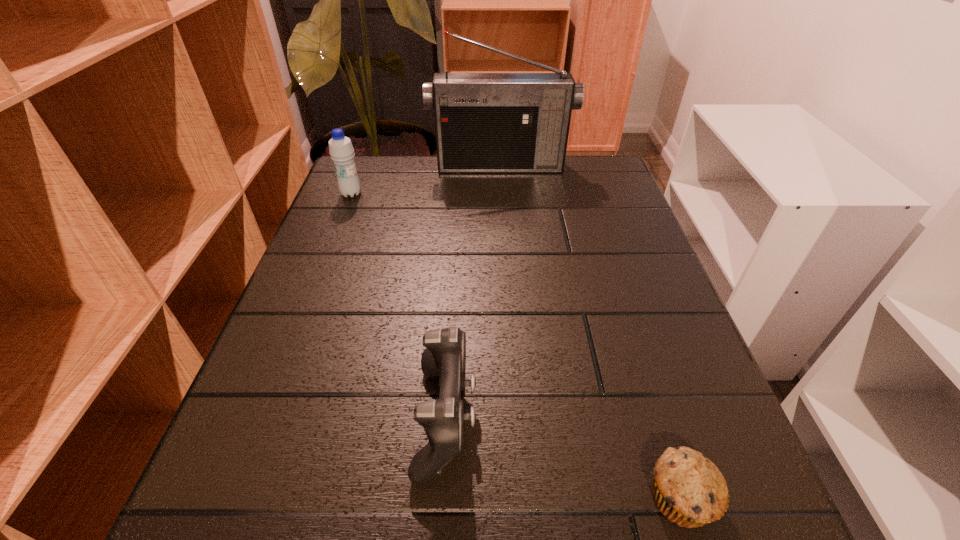
Locate an element on the screen. This screenshot has width=960, height=540. the farthest object is located at coordinates (484, 122).

Locate an element on the screen. the tallest object is located at coordinates (484, 122).

What are the coordinates of `the third shortest object` in the screenshot? It's located at (341, 151).

The image size is (960, 540). In order to click on the leftmost object in this screenshot , I will do `click(341, 151)`.

The width and height of the screenshot is (960, 540). I want to click on control, so click(443, 419).

Image resolution: width=960 pixels, height=540 pixels. Identify the location of muffin. (689, 490).

At what (x,y) coordinates should I click in order to perform the action: click on vacant space positioned 0.360m on the front-facing side of the radio receiver. Please return your answer as a coordinate pair (x, y). The image size is (960, 540). Looking at the image, I should click on (507, 265).

At what (x,y) coordinates should I click in order to perform the action: click on vacant space located on the front of the water bottle. Please return your answer as a coordinate pair (x, y). The image size is (960, 540). Looking at the image, I should click on (306, 308).

Find the location of a particular element. free space located 0.360m on the surface of the control with buttons is located at coordinates (721, 418).

Locate an element on the screen. This screenshot has width=960, height=540. vacant region located on the left of the muffin is located at coordinates (491, 497).